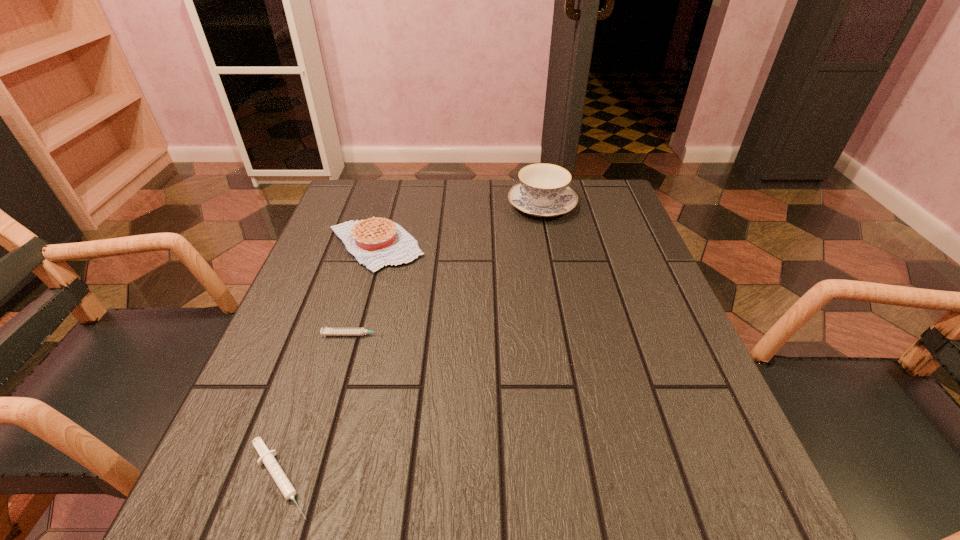
The height and width of the screenshot is (540, 960). I want to click on vacant area that lies between the farther syringe and the pie, so click(365, 290).

Locate an element on the screen. The width and height of the screenshot is (960, 540). unoccupied position between the farther syringe and the nearer syringe is located at coordinates (318, 407).

This screenshot has width=960, height=540. In order to click on vacant area that lies between the tallest object and the farther syringe in this screenshot , I will do `click(448, 270)`.

This screenshot has height=540, width=960. In order to click on object that is the closest one to the pie in this screenshot , I will do `click(325, 331)`.

Identify which object is the second nearest to the chinaware. Please provide its 2D coordinates. Your answer should be formatted as a tuple, i.e. [(x, y)], where the tuple contains the x and y coordinates of a point satisfying the conditions above.

[(325, 331)]